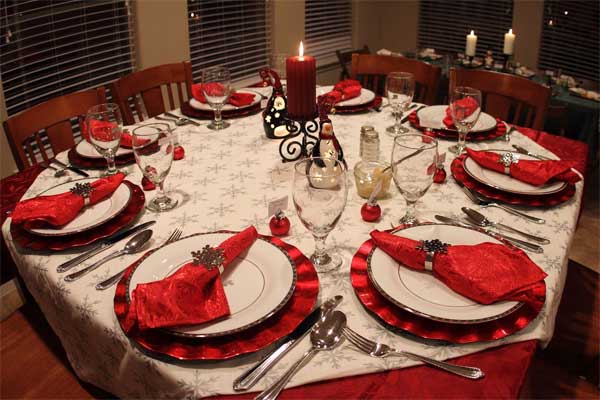
Find the location of a particular element. The image size is (600, 400). candles and flames is located at coordinates (470, 40), (506, 41), (306, 73), (302, 53), (471, 29), (509, 31).